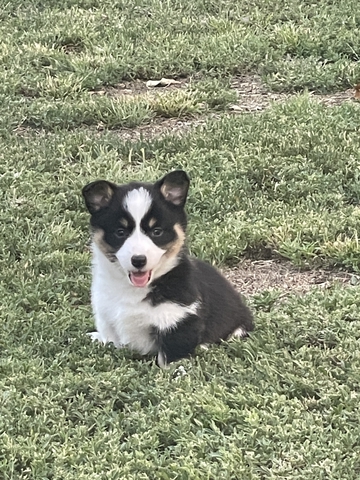
Image resolution: width=360 pixels, height=480 pixels. I want to click on chest, so click(x=125, y=293).